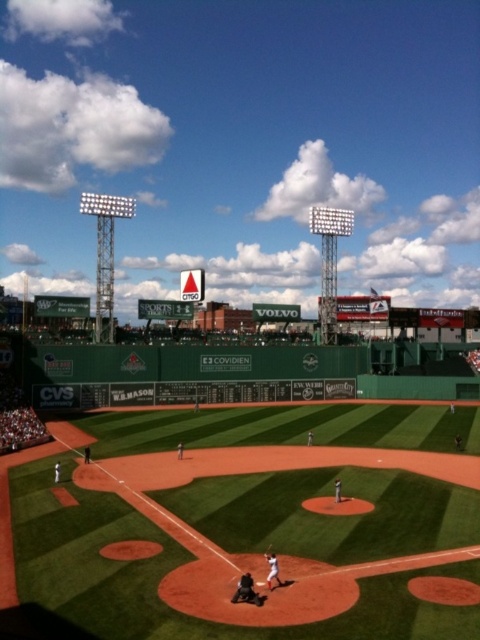
You are a drone operator tasked with capturing aerial footage of the baseball game at Fenway Park. Your drone is currently hovering at point [247,531]. What is the immediate surface beneath your drone?

The immediate surface beneath the drone at point [247,531] is the green turf field at center.

You are a photographer standing at the edge of the field and want to take a photo of the dark gray fabric catcher at lower center. The camera you are using has a maximum focus range of 30 meters. Will the camera be able to focus on the catcher?

The dark gray fabric catcher at lower center and camera are 28.89 meters apart. Since the camera can focus up to 30 meters, it will be able to focus on the catcher.